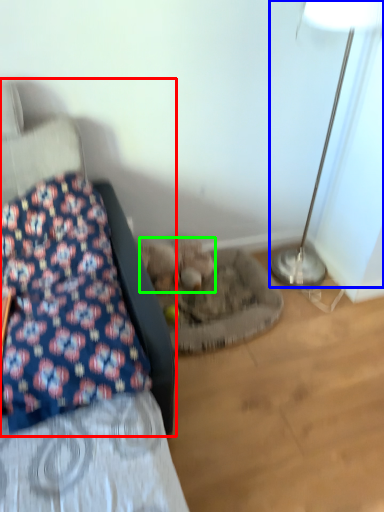
Question: Considering the real-world distances, which object is closest to furniture (highlighted by a red box)? lamp (highlighted by a blue box) or animal (highlighted by a green box).

Choices:
 (A) lamp
 (B) animal

Answer: (B)